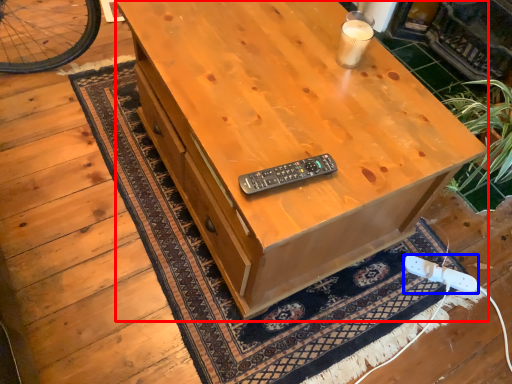
Question: Which point is closer to the camera, desk (highlighted by a red box) or game controller (highlighted by a blue box)?

Choices:
 (A) desk
 (B) game controller

Answer: (A)